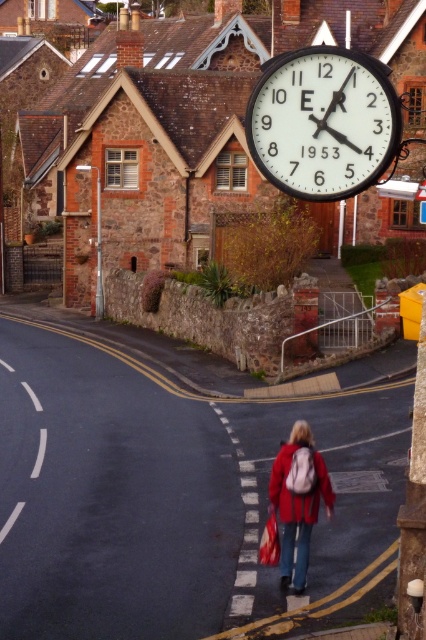
Question: Is black metal clock at upper center above red matte jacket at lower center?

Choices:
 (A) no
 (B) yes

Answer: (B)

Question: Among these objects, which one is nearest to the camera?

Choices:
 (A) red matte jacket at lower center
 (B) black metal clock at upper center

Answer: (A)

Question: Does black metal clock at upper center lie behind red matte jacket at lower center?

Choices:
 (A) no
 (B) yes

Answer: (B)

Question: Among these objects, which one is farthest from the camera?

Choices:
 (A) red matte jacket at lower center
 (B) black metal clock at upper center

Answer: (B)

Question: Does black metal clock at upper center come in front of red matte jacket at lower center?

Choices:
 (A) yes
 (B) no

Answer: (B)